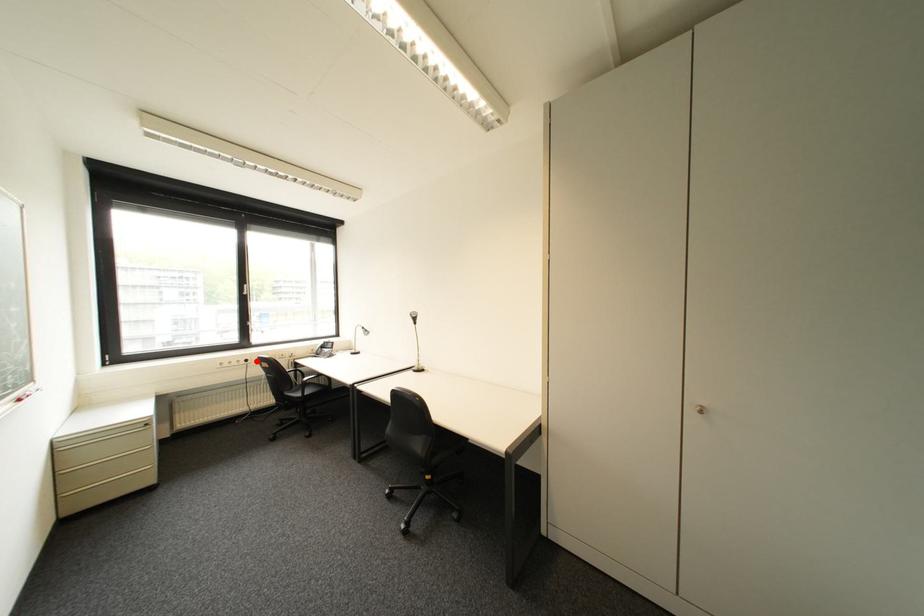
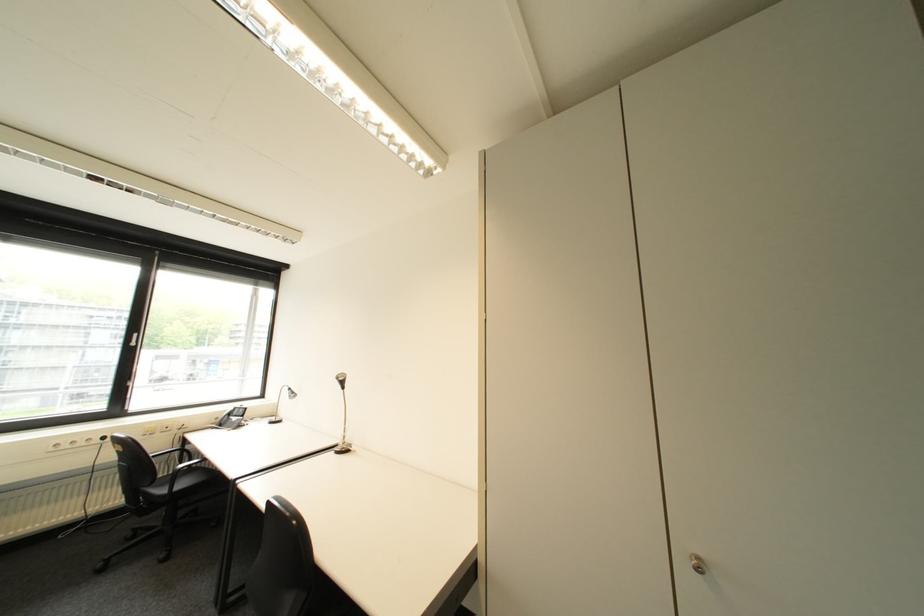
In the second image, find the point that corresponds to the highlighted location in the first image.

(114, 439)